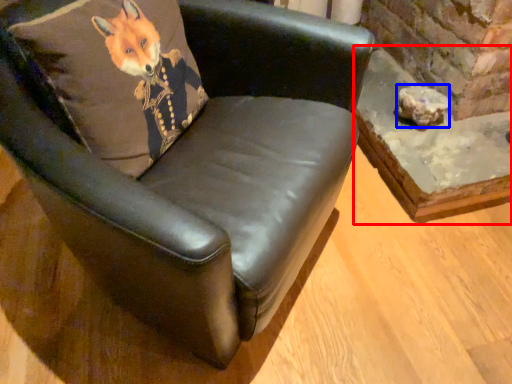
Question: Which point is further to the camera, table (highlighted by a red box) or stone (highlighted by a blue box)?

Choices:
 (A) table
 (B) stone

Answer: (B)